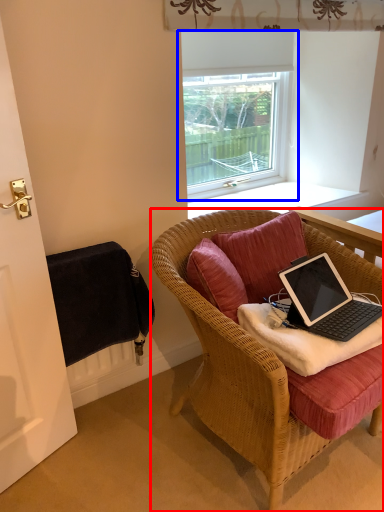
Question: Which point is further to the camera, chair (highlighted by a red box) or window (highlighted by a blue box)?

Choices:
 (A) chair
 (B) window

Answer: (B)